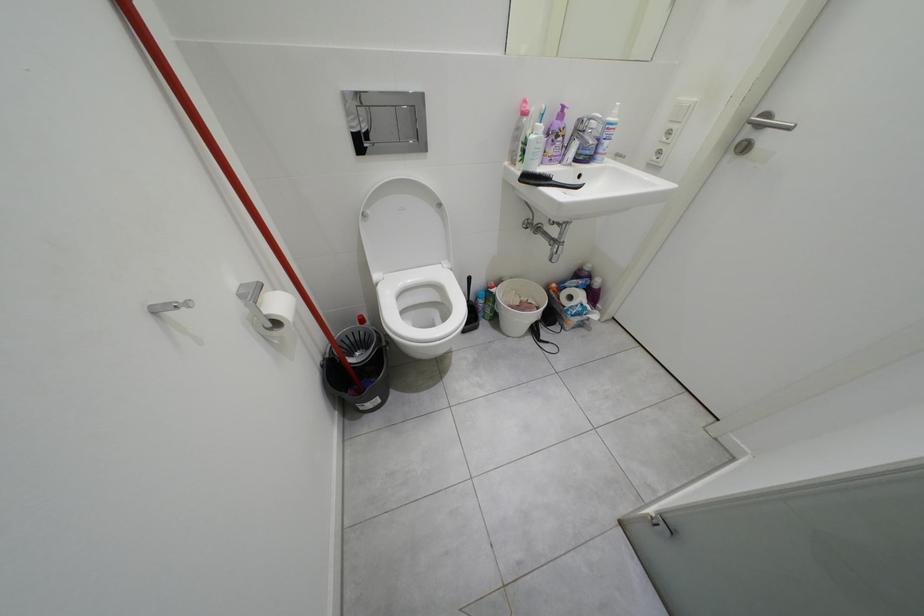
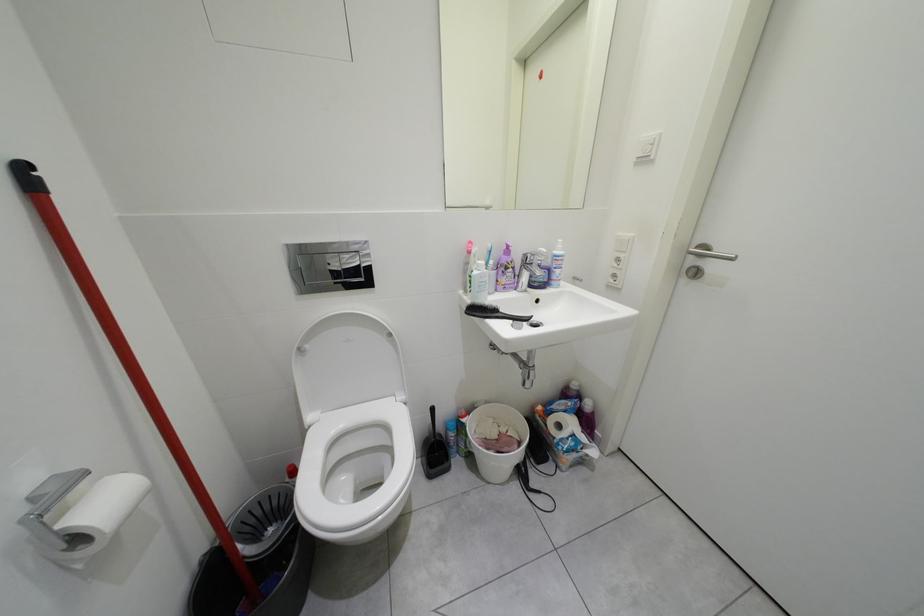
What movement of the cameraman would produce the second image?

The movement direction of the cameraman is right, forward.